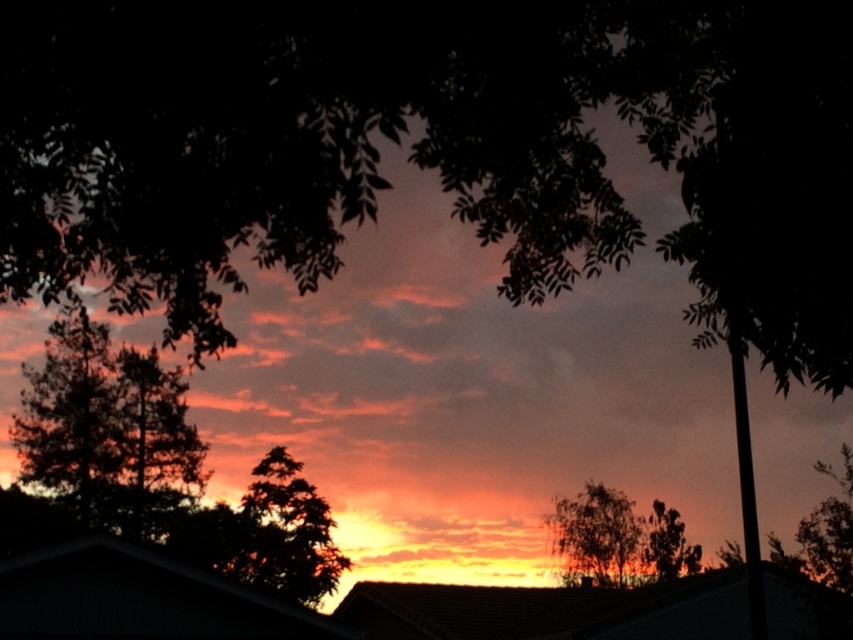
How much distance is there between dark green leafy tree at left and green leafy tree at center?

dark green leafy tree at left is 84.36 feet from green leafy tree at center.

Is point (76, 381) positioned in front of point (619, 573)?

That is True.

In order to click on dark green leafy tree at left in this screenshot , I will do `click(71, 419)`.

Can you confirm if dark green leafy tree at left is smaller than green textured tree at left?

Actually, dark green leafy tree at left might be larger than green textured tree at left.

Is dark green leafy tree at left taller than green textured tree at left?

Indeed, dark green leafy tree at left has a greater height compared to green textured tree at left.

Describe the element at coordinates (71, 419) in the screenshot. Image resolution: width=853 pixels, height=640 pixels. I see `dark green leafy tree at left` at that location.

You are a GUI agent. You are given a task and a screenshot of the screen. Output one action in this format:
    pyautogui.click(x=<x>, y=<y>)
    Task: Click on the dark green leafy tree at left
    The height and width of the screenshot is (640, 853).
    Given the screenshot: What is the action you would take?
    pyautogui.click(x=71, y=419)

Who is more forward, (39, 436) or (669, 561)?

Point (39, 436) is more forward.

Is point (80, 374) closer to viewer compared to point (675, 564)?

That is True.

Is point (86, 492) positioned behind point (675, 540)?

No, it is in front of (675, 540).

The image size is (853, 640). In order to click on dark green leafy tree at left in this screenshot , I will do point(71,419).